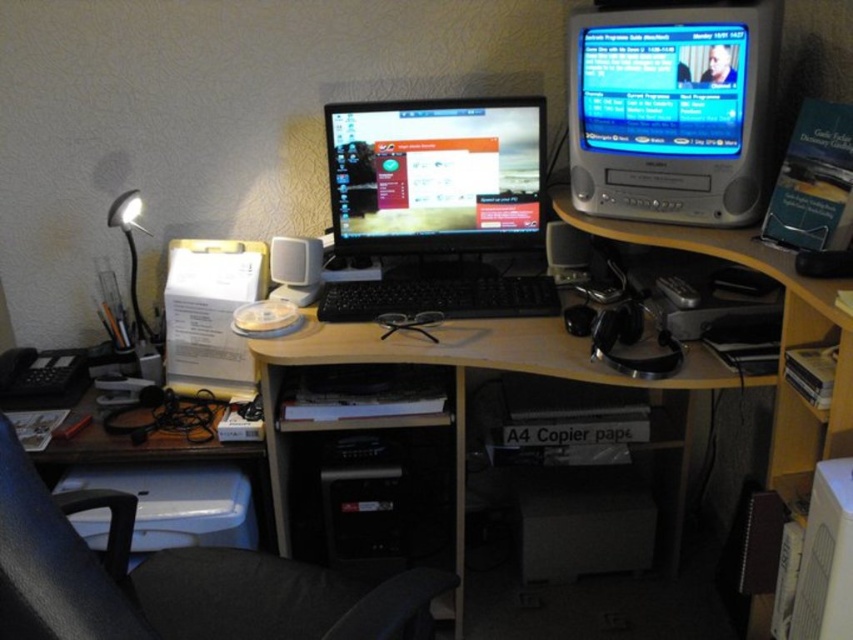
Can you confirm if black glossy monitor at center is positioned to the right of matte silver lamp at left?

Yes, black glossy monitor at center is to the right of matte silver lamp at left.

Who is higher up, black glossy monitor at center or matte silver lamp at left?

Positioned higher is black glossy monitor at center.

The height and width of the screenshot is (640, 853). What do you see at coordinates (436, 205) in the screenshot? I see `black glossy monitor at center` at bounding box center [436, 205].

The width and height of the screenshot is (853, 640). In order to click on black glossy monitor at center in this screenshot , I will do `click(436, 205)`.

Which is in front, point (670, 180) or point (567, 259)?

Point (670, 180) is more forward.

Who is more distant from viewer, (679, 221) or (579, 240)?

Positioned behind is point (579, 240).

Based on the photo, who is more distant from viewer, (593, 168) or (558, 241)?

Point (558, 241)

Locate an element on the screen. The width and height of the screenshot is (853, 640). silver metallic television at upper right is located at coordinates (671, 108).

Between white plastic speaker at center and satin silver speaker at center, which one is positioned higher?

Positioned higher is satin silver speaker at center.

Is point (270, 292) behind point (553, 228)?

Yes.

Who is more distant from viewer, (x=312, y=241) or (x=570, y=237)?

The point (x=570, y=237) is behind.

Where is `white plastic speaker at center`? This screenshot has width=853, height=640. white plastic speaker at center is located at coordinates (294, 268).